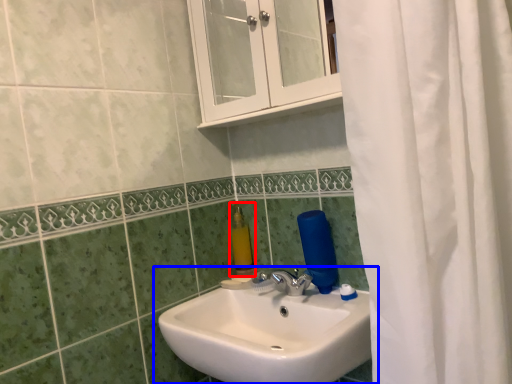
Question: Which point is further to the camera, soap dispenser (highlighted by a red box) or sink (highlighted by a blue box)?

Choices:
 (A) soap dispenser
 (B) sink

Answer: (A)